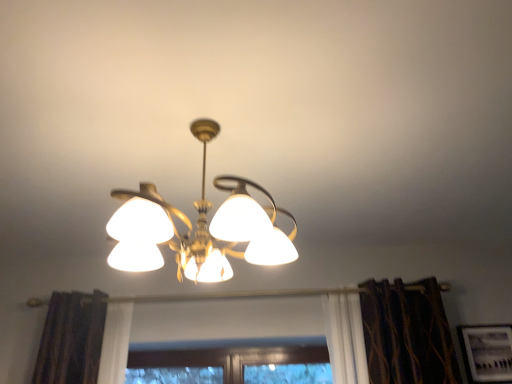
Question: Is matte white picture frame at lower right in front of or behind gold metallic chandelier at center in the image?

Choices:
 (A) front
 (B) behind

Answer: (B)

Question: From the image's perspective, is matte white picture frame at lower right positioned above or below gold metallic chandelier at center?

Choices:
 (A) below
 (B) above

Answer: (A)

Question: In the image, is matte white picture frame at lower right on the left side or the right side of gold metallic chandelier at center?

Choices:
 (A) left
 (B) right

Answer: (B)

Question: Choose the correct answer: Is gold metallic chandelier at center inside matte white picture frame at lower right or outside it?

Choices:
 (A) outside
 (B) inside

Answer: (A)

Question: From their relative heights in the image, would you say gold metallic chandelier at center is taller or shorter than matte white picture frame at lower right?

Choices:
 (A) short
 (B) tall

Answer: (B)

Question: Is point (244, 230) closer or farther from the camera than point (466, 362)?

Choices:
 (A) closer
 (B) farther

Answer: (A)

Question: From the image's perspective, is gold metallic chandelier at center positioned above or below matte white picture frame at lower right?

Choices:
 (A) above
 (B) below

Answer: (A)